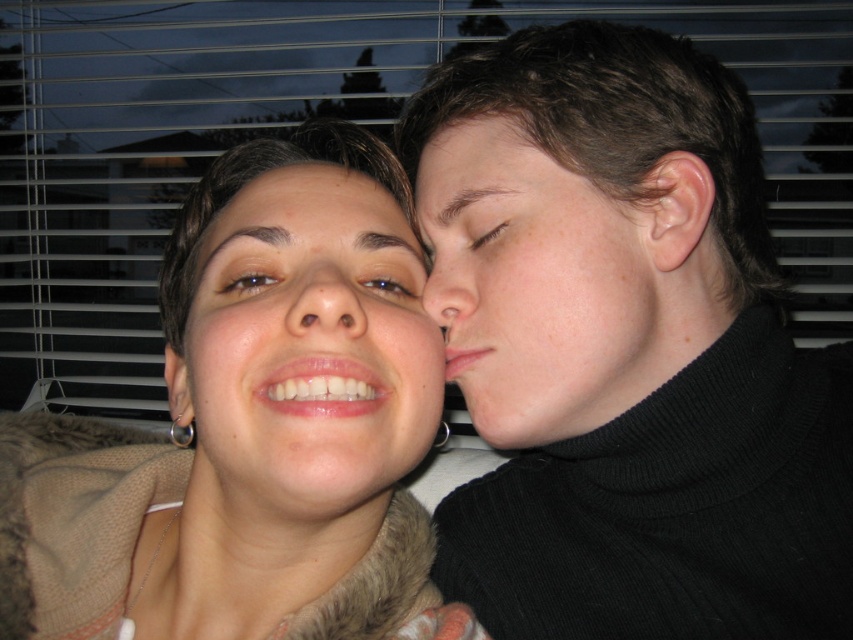
Question: Is white fur at upper center positioned at the back of blue glossy eye at upper center?

Choices:
 (A) no
 (B) yes

Answer: (B)

Question: Is black turtleneck sweater at right thinner than brown matte eye at upper left?

Choices:
 (A) yes
 (B) no

Answer: (B)

Question: Is the position of white fur at upper center more distant than that of blue glossy eye at upper center?

Choices:
 (A) yes
 (B) no

Answer: (A)

Question: Considering the real-world distances, which object is farthest from the smooth skin nose at center?

Choices:
 (A) white fur at upper center
 (B) brown matte eye at upper left

Answer: (A)

Question: Estimate the real-world distances between objects in this image. Which object is farther from the fuzzy brown sweater at upper left?

Choices:
 (A) matte fur at center
 (B) black turtleneck sweater at right

Answer: (B)

Question: Which object is farther from the camera taking this photo?

Choices:
 (A) brown matte eye at upper left
 (B) matte skin nose at center
 (C) smooth skin face at right
 (D) matte fur at center

Answer: (A)